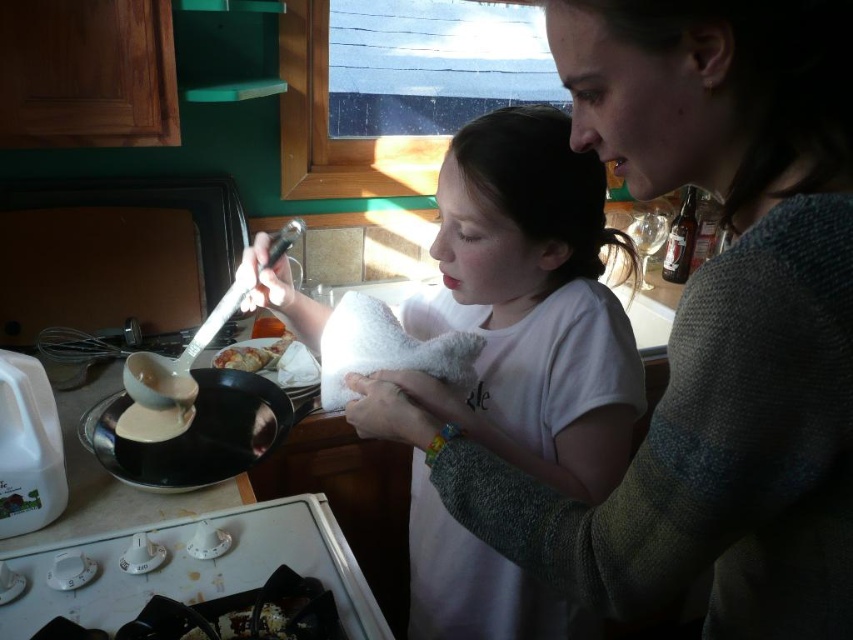
You are a chef preparing a meal and need to place the slightly browned crispy chicken at center onto the counter. Where should you place it so that it doesn not block the knitted gray sweater at upper right?

The knitted gray sweater at upper right is to the right of the slightly browned crispy chicken at center, so placing the slightly browned crispy chicken at center to the left side of the counter would prevent it from blocking the knitted gray sweater at upper right.

You are a chef preparing to serve the slightly browned crispy chicken at center. You need to place it on a plate that is under the knitted gray sweater at upper right. Is the plate accessible without moving the sweater?

The knitted gray sweater at upper right is closer to the viewer than the slightly browned crispy chicken at center, so the sweater is in front of the chicken. Therefore, the plate under the sweater would be blocked by the sweater, making it inaccessible without moving it.

You are standing in the kitchen and need to reach the white glossy stove at lower left. Which direction should you move relative to your current position at point (196, 568)?

You are already at the white glossy stove at lower left, so no movement is needed.